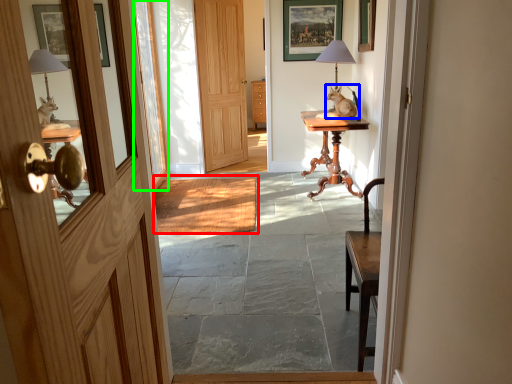
Question: Considering the real-world distances, which object is closest to doormat (highlighted by a red box)? open (highlighted by a blue box) or glass door (highlighted by a green box).

Choices:
 (A) open
 (B) glass door

Answer: (B)